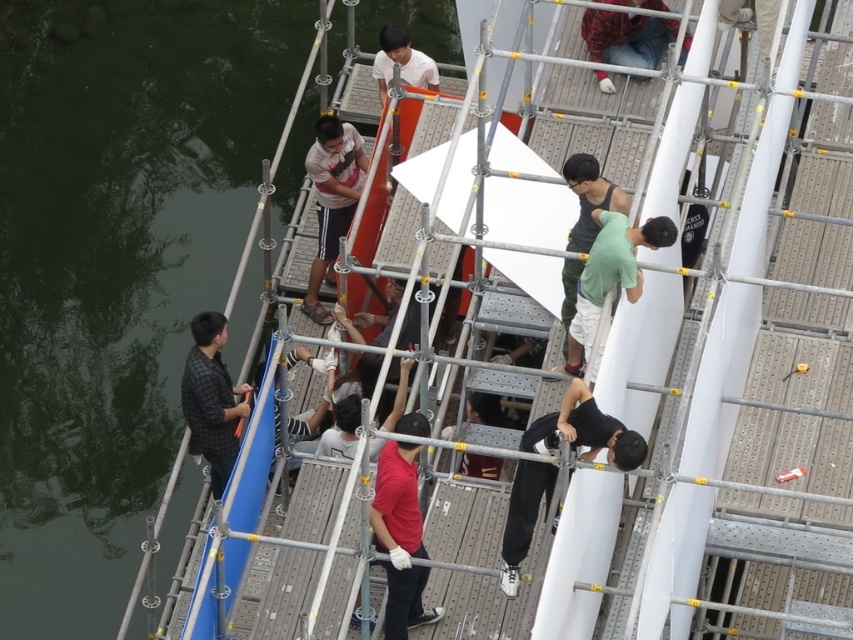
Question: Is matte red shirt at center above green cotton shirt at center?

Choices:
 (A) yes
 (B) no

Answer: (B)

Question: Among these points, which one is farthest from the camera?

Choices:
 (A) (216, 348)
 (B) (345, 184)

Answer: (B)

Question: Which point is farther to the camera?

Choices:
 (A) (602, 305)
 (B) (218, 422)

Answer: (B)

Question: Among these points, which one is nearest to the camera?

Choices:
 (A) (345, 148)
 (B) (200, 432)
 (C) (509, 538)

Answer: (C)

Question: Does black checkered shirt at lower left have a smaller size compared to denim jeans at center?

Choices:
 (A) no
 (B) yes

Answer: (A)

Question: Is black checkered shirt at lower left smaller than light gray fabric shirt at center?

Choices:
 (A) yes
 (B) no

Answer: (A)